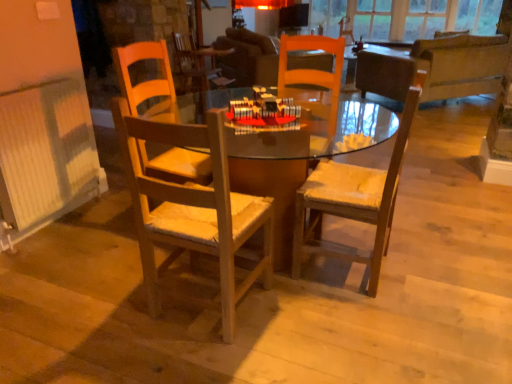
Image resolution: width=512 pixels, height=384 pixels. I want to click on space that is in front of wooden chair at center, which ranks as the second chair in right-to-left order, so click(x=178, y=361).